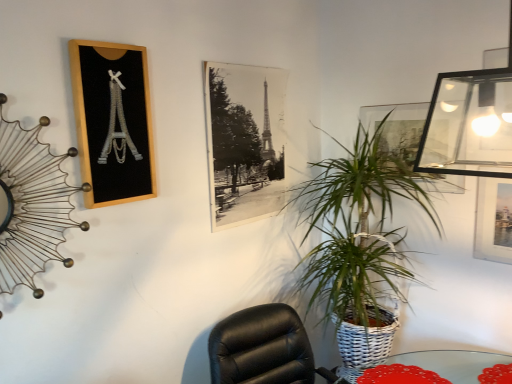
Question: In the image, is black paper at center, which appears as the second picture frame when viewed from the left, positioned in front of or behind gold wire clock at upper left?

Choices:
 (A) behind
 (B) front

Answer: (A)

Question: Considering the relative positions of black paper at center, the 2th picture frame positioned from the right, and gold wire clock at upper left in the image provided, is black paper at center, the 2th picture frame positioned from the right, to the left or to the right of gold wire clock at upper left?

Choices:
 (A) left
 (B) right

Answer: (B)

Question: Estimate the real-world distances between objects in this image. Which object is closer to the gold wire clock at upper left?

Choices:
 (A) black paper at center, the 2th picture frame positioned from the right
 (B) wooden picture frame at upper left, acting as the first picture frame starting from the left
 (C) clear glass table at lower right
 (D) transparent glass picture frame at upper right, placed as the 3th picture frame when sorted from left to right
 (E) green woven basket at center-right

Answer: (B)

Question: Which of these objects is positioned closest to the green woven basket at center-right?

Choices:
 (A) gold wire clock at upper left
 (B) clear glass table at lower right
 (C) wooden picture frame at upper left, the 3th picture frame from the right
 (D) transparent glass picture frame at upper right, placed as the 3th picture frame when sorted from left to right
 (E) black paper at center, which appears as the second picture frame when viewed from the left

Answer: (D)